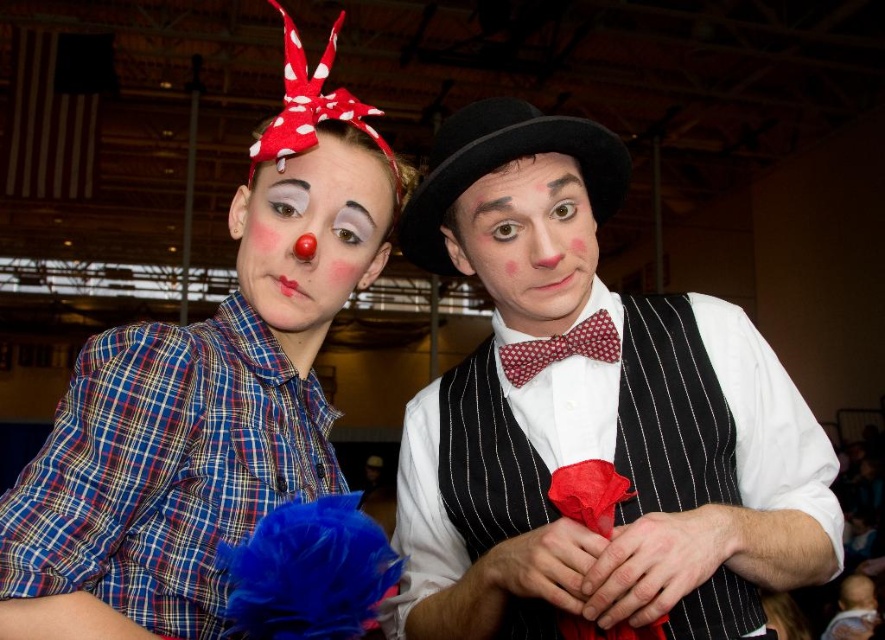
Please provide the coordinates of the matte clown nose at center in the image. The coordinates should be in the format of a tuple with two decimal numbers separated by a comma, enclosed in parentheses.

The coordinates of the matte clown nose at center are at point (312, 232).

You are a photographer taking a picture of the matte black vest at center and the red dotted bow tie at center. Which one will appear larger in your photo?

The matte black vest at center will appear larger in the photo because it is closer to the viewer than the red dotted bow tie at center.

You are standing in the middle of the indoor hall and see two points marked on the floor. The first point is at position point (370, 246) and the second point is at point (522, 168). If you want to walk towards the point that is closer to the clown with the red flower, which point should you walk towards?

The clown with the red flower is holding the red flower, which is part of the description of the individual on the right. Since point (522, 168) is closer to the clown on the right, you should walk towards point (522, 168).